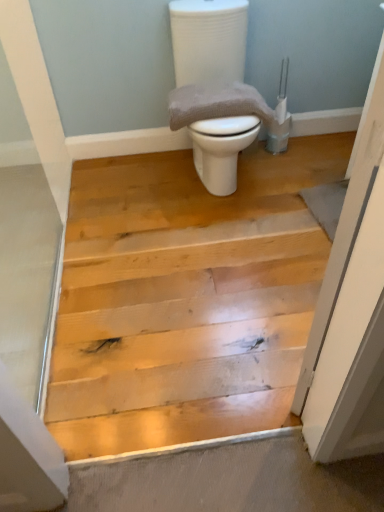
At what (x,y) coordinates should I click in order to perform the action: click on free space above gray textured towel at center (from a real-world perspective). Please return your answer as a coordinate pair (x, y). This screenshot has width=384, height=512. Looking at the image, I should click on (213, 97).